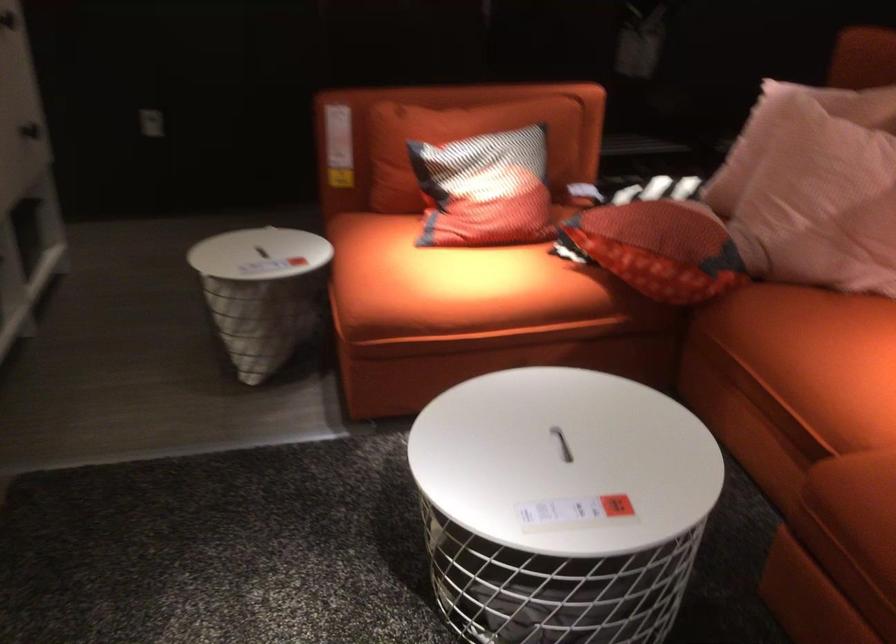
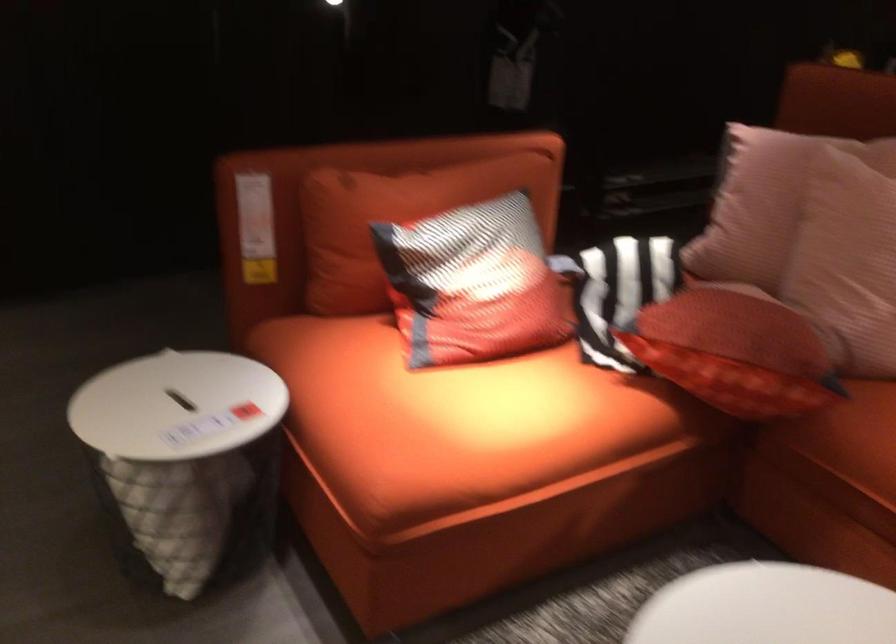
In a continuous first-person perspective shot, in which direction is the camera moving?

The cameraman moved toward left, forward.